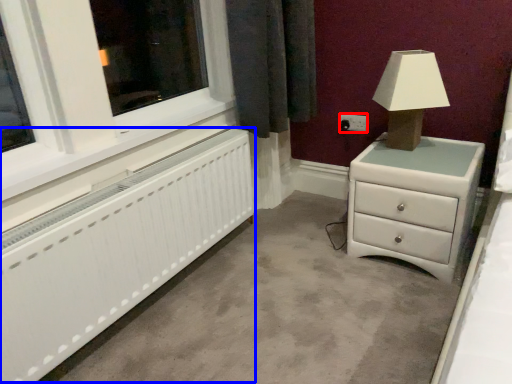
Question: Which object is further to the camera taking this photo, electric outlet (highlighted by a red box) or radiator (highlighted by a blue box)?

Choices:
 (A) electric outlet
 (B) radiator

Answer: (A)